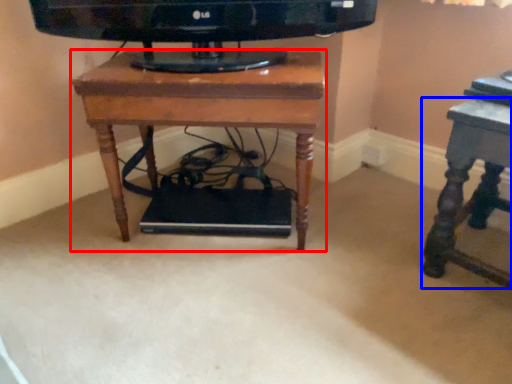
Question: Among these objects, which one is nearest to the camera, table (highlighted by a red box) or table (highlighted by a blue box)?

Choices:
 (A) table
 (B) table

Answer: (B)